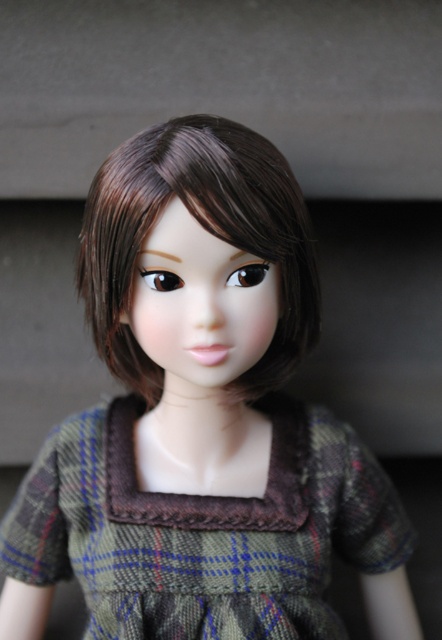
Does point (129, 580) lie behind point (259, 381)?

No, (129, 580) is in front of (259, 381).

Is point (358, 512) farther from viewer compared to point (206, 147)?

Yes, point (358, 512) is farther from viewer.

The image size is (442, 640). I want to click on plaid fabric dress at center, so click(x=204, y=531).